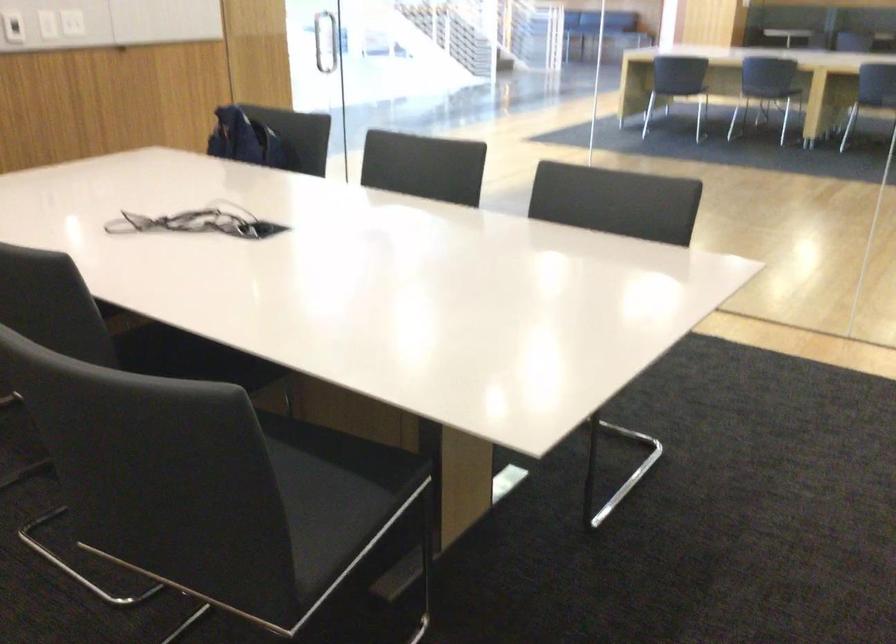
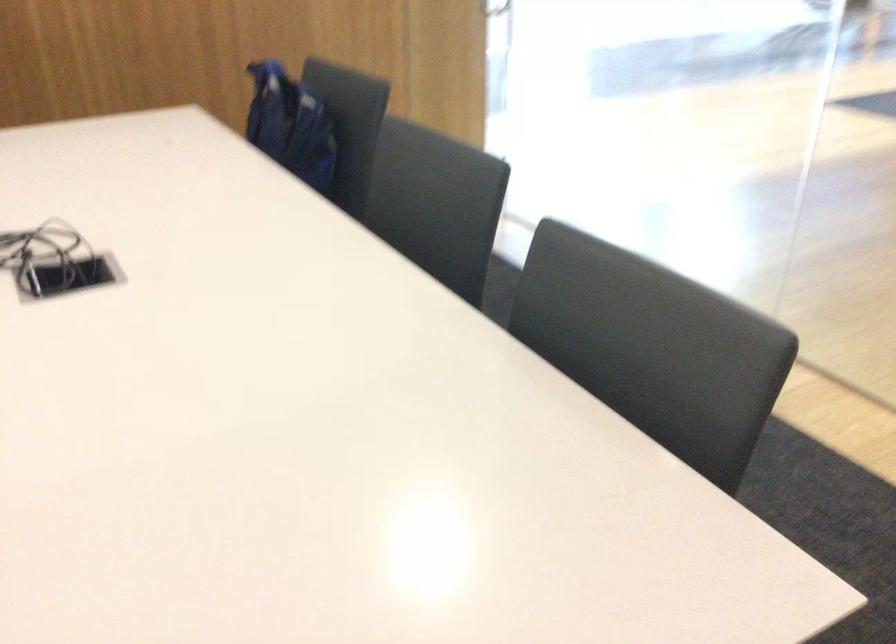
Locate, in the second image, the point that corresponds to (255,149) in the first image.

(289, 125)